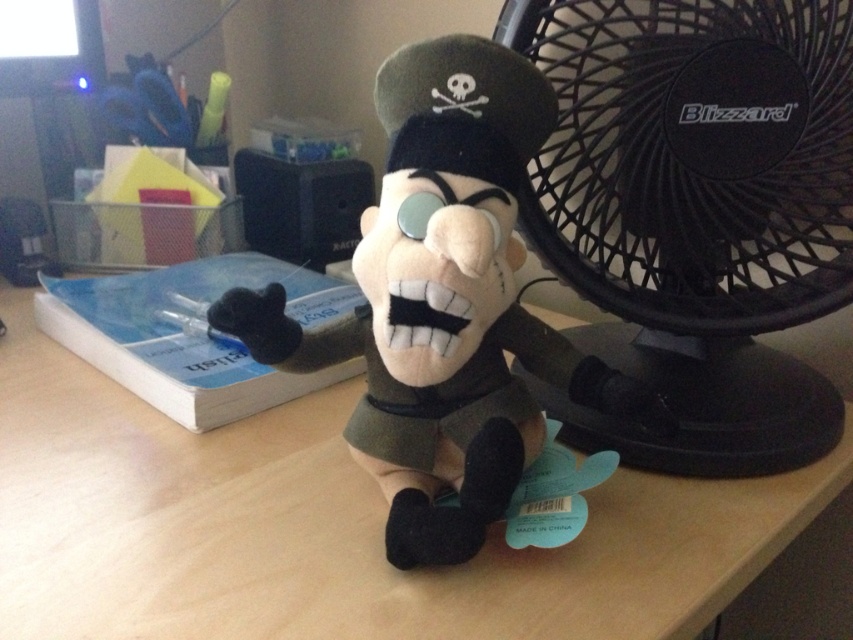
Based on the photo, you are holding a ruler and need to measure the distance from your eyes to the black plastic fan at right. Can you estimate if it is more than half a meter?

The distance of black plastic fan at right from viewer is 55.73 centimeters, so yes, it is more than half a meter.

You are organizing a desk and want to place a new small decorative item between the black plastic fan at right and the soft plush toy at center. Given their sizes, which object should you place the item closer to to ensure it doesn

The black plastic fan at right is larger than the soft plush toy at center. Therefore, you should place the new item closer to the soft plush toy at center to maintain balance and avoid overcrowding.

You are taking a photo of the pirate plush toy and want to focus on a specific point. If you focus on point [260,509] and point [680,456], which point will be in sharper focus?

Point [260,509] is closer to the camera than point [680,456], so it will be in sharper focus.